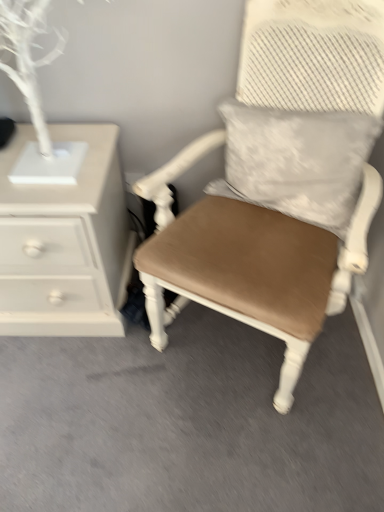
I want to click on vacant space in front of matte brown cushioned chair at center, so click(x=246, y=444).